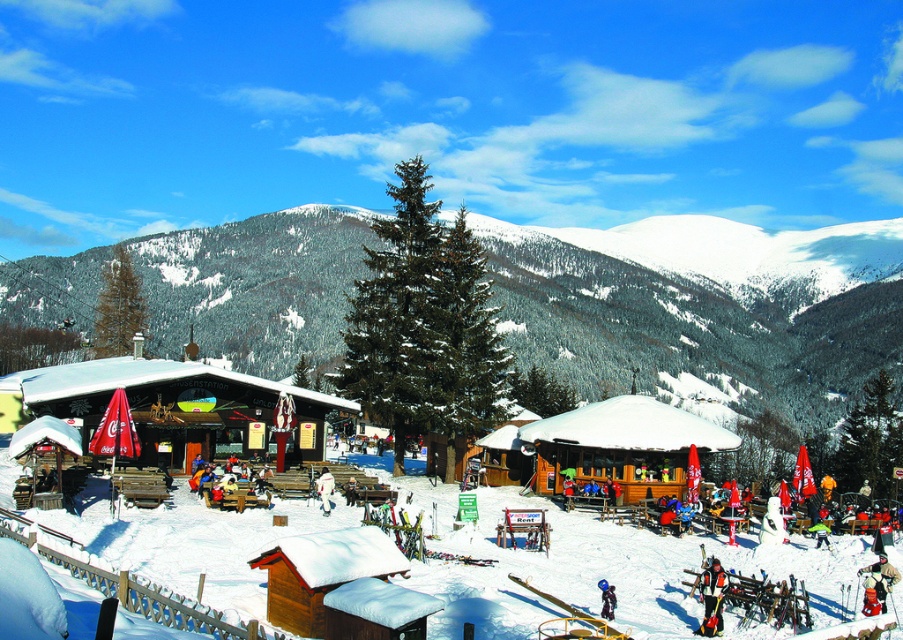
Question: Which point is farther from the camera taking this photo?

Choices:
 (A) (x=589, y=630)
 (B) (x=319, y=483)
 (C) (x=163, y=416)
 (D) (x=587, y=413)

Answer: (D)

Question: Is snowy mountain at center below wooden cabin at center?

Choices:
 (A) yes
 (B) no

Answer: (B)

Question: Does wooden tent at center have a lesser width compared to metallic silver ski at lower center?

Choices:
 (A) yes
 (B) no

Answer: (B)

Question: Which of the following is the farthest from the observer?

Choices:
 (A) [x=538, y=612]
 (B) [x=697, y=628]
 (C) [x=613, y=333]
 (D) [x=434, y=248]

Answer: (C)

Question: Which point is farther from the camera taking this photo?

Choices:
 (A) (575, 620)
 (B) (714, 600)
 (C) (317, 547)

Answer: (B)

Question: Does wooden cabin at center have a smaller size compared to blue fabric snowsuit at center?

Choices:
 (A) no
 (B) yes

Answer: (A)